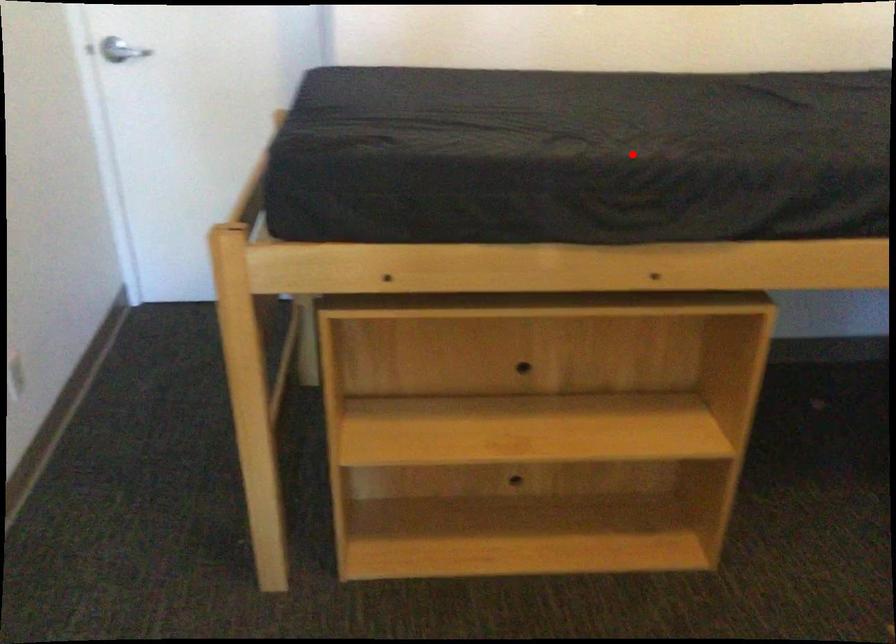
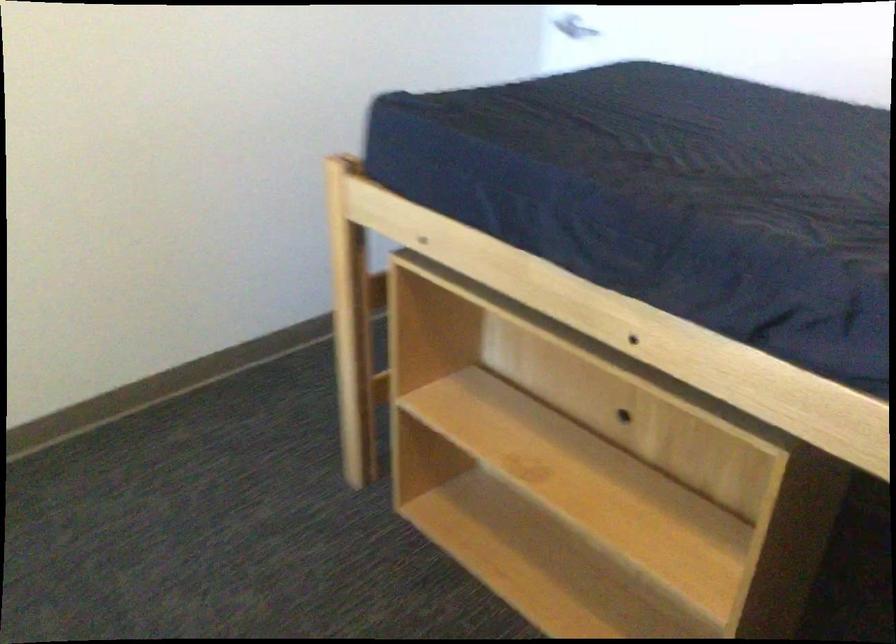
The point at the highlighted location is marked in the first image. Where is the corresponding point in the second image?

(651, 193)